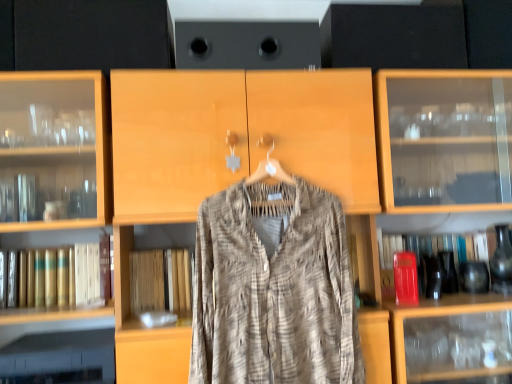
Question: Considering the relative sizes of gold leather book at left, the second book from the right, and textured beige shirt at center in the image provided, is gold leather book at left, the second book from the right, thinner than textured beige shirt at center?

Choices:
 (A) yes
 (B) no

Answer: (B)

Question: Could you tell me if gold leather book at left, which is counted as the first book, starting from the left, is turned towards textured beige shirt at center?

Choices:
 (A) no
 (B) yes

Answer: (A)

Question: Is gold leather book at left, which is counted as the first book, starting from the left, further to camera compared to textured beige shirt at center?

Choices:
 (A) yes
 (B) no

Answer: (A)

Question: Is gold leather book at left, which is counted as the first book, starting from the left, positioned with its back to textured beige shirt at center?

Choices:
 (A) no
 (B) yes

Answer: (A)

Question: Can you confirm if gold leather book at left, which is counted as the first book, starting from the left, is positioned to the right of textured beige shirt at center?

Choices:
 (A) yes
 (B) no

Answer: (B)

Question: Would you say red matte book at right, the second book positioned from the left, is inside or outside textured beige shirt at center?

Choices:
 (A) inside
 (B) outside

Answer: (B)

Question: Does point [x=472, y=244] appear closer or farther from the camera than point [x=231, y=193]?

Choices:
 (A) farther
 (B) closer

Answer: (A)

Question: In the image, is red matte book at right, the second book positioned from the left, on the left side or the right side of textured beige shirt at center?

Choices:
 (A) right
 (B) left

Answer: (A)

Question: Considering the positions of red matte book at right, the 1th book positioned from the right, and textured beige shirt at center in the image, is red matte book at right, the 1th book positioned from the right, bigger or smaller than textured beige shirt at center?

Choices:
 (A) big
 (B) small

Answer: (B)

Question: Considering the relative positions of textured beige shirt at center and gold leather book at left, which is counted as the first book, starting from the left, in the image provided, is textured beige shirt at center to the left or to the right of gold leather book at left, which is counted as the first book, starting from the left,?

Choices:
 (A) left
 (B) right

Answer: (B)

Question: Is textured beige shirt at center taller or shorter than gold leather book at left, the second book from the right?

Choices:
 (A) short
 (B) tall

Answer: (B)

Question: Considering the positions of textured beige shirt at center and gold leather book at left, which is counted as the first book, starting from the left, in the image, is textured beige shirt at center wider or thinner than gold leather book at left, which is counted as the first book, starting from the left,?

Choices:
 (A) wide
 (B) thin

Answer: (B)

Question: From the image's perspective, is textured beige shirt at center located above or below gold leather book at left, which is counted as the first book, starting from the left?

Choices:
 (A) above
 (B) below

Answer: (A)

Question: Considering the positions of gold leather book at left, the second book from the right, and textured beige shirt at center in the image, is gold leather book at left, the second book from the right, bigger or smaller than textured beige shirt at center?

Choices:
 (A) big
 (B) small

Answer: (B)

Question: From the image's perspective, is gold leather book at left, the second book from the right, located above or below textured beige shirt at center?

Choices:
 (A) below
 (B) above

Answer: (A)